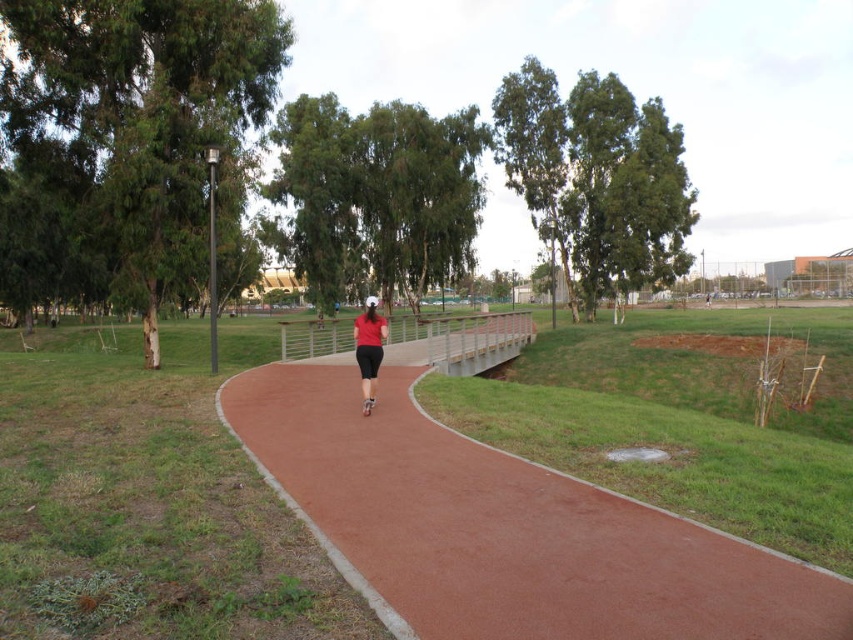
Question: Can you confirm if smooth reddish-brown trail at center is wider than matte red shirt at center?

Choices:
 (A) yes
 (B) no

Answer: (A)

Question: Does smooth reddish-brown trail at center appear on the right side of matte red shirt at center?

Choices:
 (A) yes
 (B) no

Answer: (A)

Question: Can you confirm if smooth reddish-brown trail at center is bigger than matte red shirt at center?

Choices:
 (A) yes
 (B) no

Answer: (B)